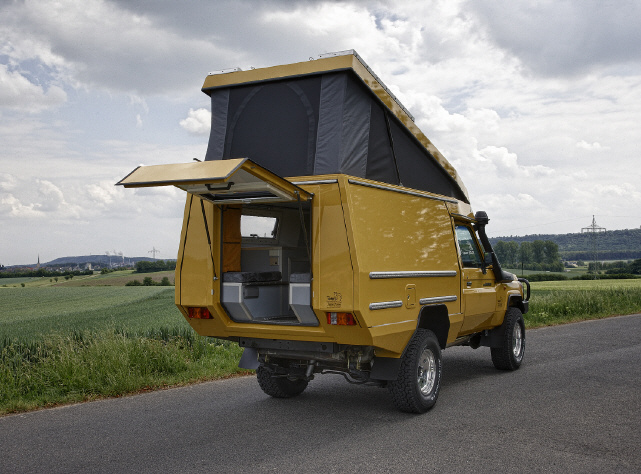
I want to click on side door, so click(x=478, y=298).